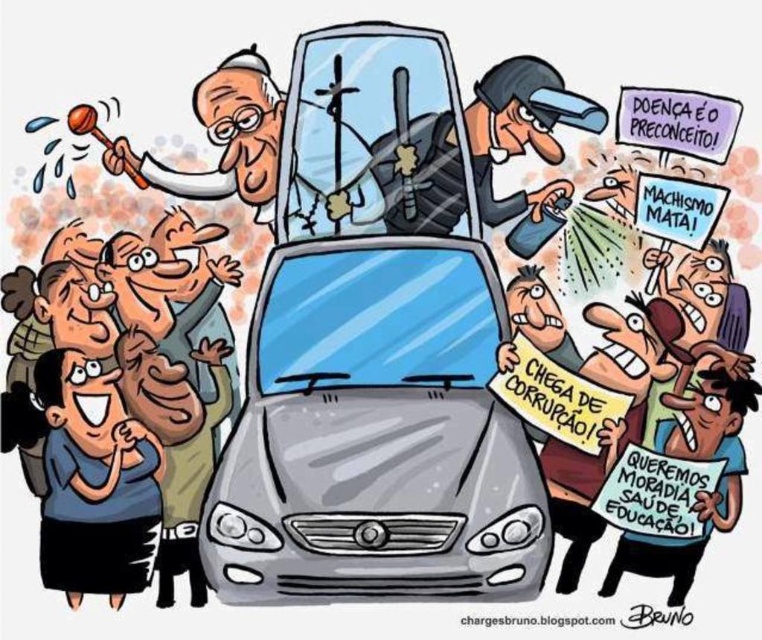
You are a photographer trying to capture the protest scene. You notice the black plastic helmet at center and the brown paper sign at lower right. Which object should you focus on to ensure both are in frame without zooming? Explain your reasoning.

The black plastic helmet at center is bigger than the brown paper sign at lower right. To ensure both are in frame without zooming, focus on the larger object, the black plastic helmet at center, as it occupies more space and will help maintain the composition balance.

Consider the image. You are a pedestrian standing at the edge of the scene. You see the gray metallic car at center and the black plastic helmet at center. Which object is directly above the other?

The black plastic helmet at center is directly above the gray metallic car at center.

Consider the image. You are a protester holding a sign and standing in the crowd. You notice the black plastic helmet at center and the brown paper sign at lower right. Which object is closer to you?

The black plastic helmet at center is closer to you because it is further to the viewer than the brown paper sign at lower right.